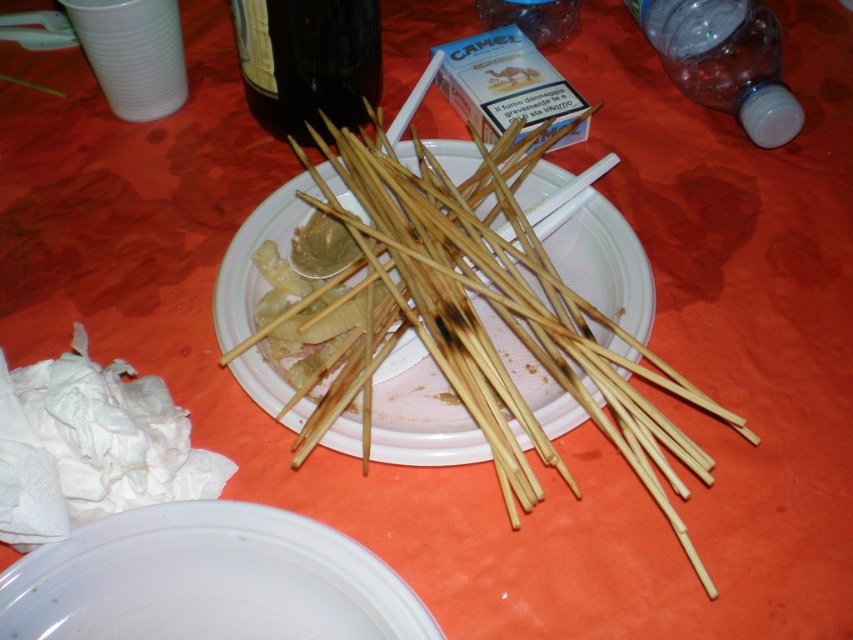
Is the position of dark glass bottle at center less distant than that of transparent plastic bottle at upper right?

Yes.

Which is in front, point (329, 99) or point (733, 72)?

Positioned in front is point (329, 99).

At what (x,y) coordinates should I click in order to perform the action: click on dark glass bottle at center. Please return your answer as a coordinate pair (x, y). The image size is (853, 640). Looking at the image, I should click on (306, 61).

Which is more to the right, bamboo skewers at center or wooden skewers at center?

bamboo skewers at center is more to the right.

Is point (515, 483) in front of point (252, 348)?

Yes, point (515, 483) is closer to viewer.

Image resolution: width=853 pixels, height=640 pixels. Describe the element at coordinates (505, 314) in the screenshot. I see `bamboo skewers at center` at that location.

Find the location of a particular element. The height and width of the screenshot is (640, 853). bamboo skewers at center is located at coordinates (505, 314).

Who is higher up, white plastic plate at lower left or wooden skewers at center?

Positioned higher is wooden skewers at center.

Does white plastic plate at lower left have a lesser height compared to wooden skewers at center?

Indeed, white plastic plate at lower left has a lesser height compared to wooden skewers at center.

Is point (225, 540) closer to camera compared to point (598, 291)?

Yes.

I want to click on white plastic plate at lower left, so click(207, 580).